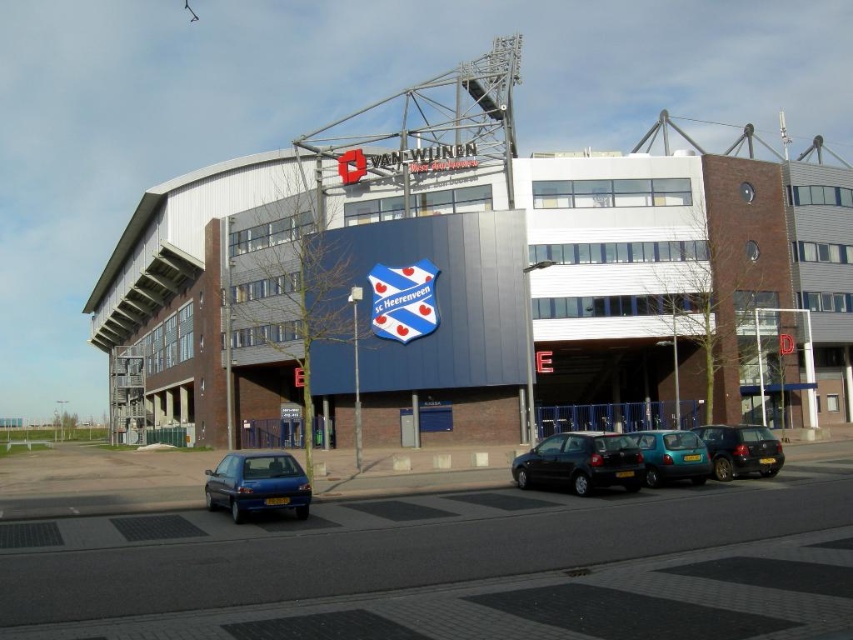
Does point (712, 179) come farther from viewer compared to point (561, 480)?

Yes, point (712, 179) is behind point (561, 480).

Locate an element on the screen. metallic gray stadium at center is located at coordinates (669, 275).

Locate an element on the screen. Image resolution: width=853 pixels, height=640 pixels. metallic gray stadium at center is located at coordinates (669, 275).

Does black glossy hatchback at center appear over teal matte hatchback at center?

Indeed, black glossy hatchback at center is positioned over teal matte hatchback at center.

Between black glossy hatchback at center and teal matte hatchback at center, which one has more height?

With more height is teal matte hatchback at center.

Between point (730, 444) and point (664, 483), which one is positioned behind?

The point (730, 444) is behind.

Find the location of a particular element. The width and height of the screenshot is (853, 640). black glossy hatchback at center is located at coordinates (740, 451).

Which is in front, point (527, 481) or point (251, 470)?

Positioned in front is point (251, 470).

Can you confirm if black matte car at center is positioned below blue metallic car at lower left?

No, black matte car at center is not below blue metallic car at lower left.

At what (x,y) coordinates should I click in order to perform the action: click on black matte car at center. Please return your answer as a coordinate pair (x, y). This screenshot has height=640, width=853. Looking at the image, I should click on (579, 461).